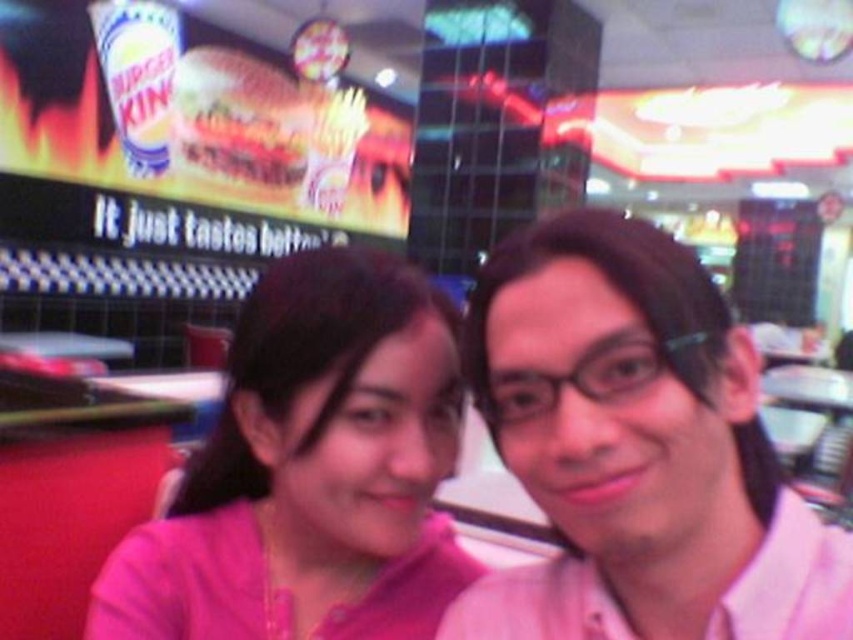
Question: Which point is farther to the camera?

Choices:
 (A) (125, 634)
 (B) (618, 396)

Answer: (A)

Question: Which point appears farthest from the camera in this image?

Choices:
 (A) (213, 612)
 (B) (498, 324)

Answer: (A)

Question: Can you confirm if pink matte shirt at center is positioned above pink fabric shirt at center?

Choices:
 (A) yes
 (B) no

Answer: (A)

Question: Is pink matte shirt at center above pink fabric shirt at center?

Choices:
 (A) no
 (B) yes

Answer: (B)

Question: Is pink matte shirt at center bigger than pink fabric shirt at center?

Choices:
 (A) yes
 (B) no

Answer: (B)